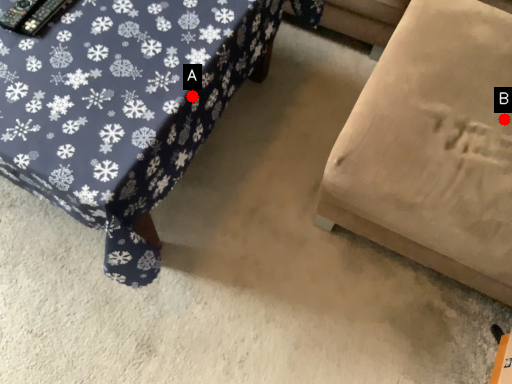
Question: Two points are circled on the image, labeled by A and B beside each circle. Which point is closer to the camera?

Choices:
 (A) A is closer
 (B) B is closer

Answer: (A)